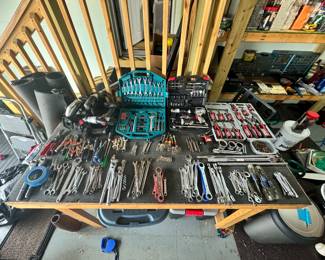
This screenshot has height=260, width=325. What are the coordinates of `cables` in the screenshot? It's located at (x=82, y=116).